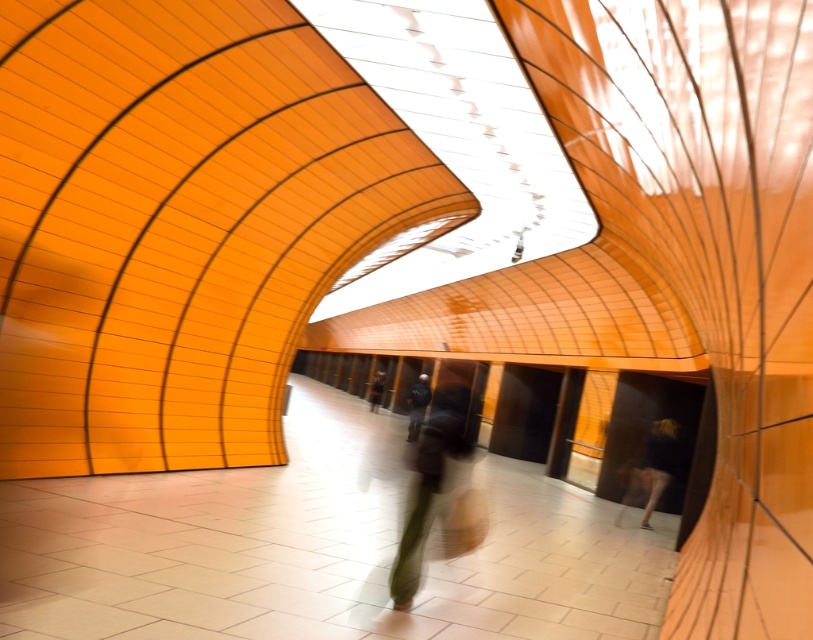
You are standing at the point marked as point (420, 401) in a modern terminal with a curved ceiling. You want to take a photo of the entire ceiling structure. Since the camera you have can capture a maximum distance of 20 meters, will you be able to capture the entire ceiling structure in one shot?

The distance between point (420, 401) and the camera is 20.18 meters, which exceeds the camera maximum distance of 20 meters. Therefore, you will not be able to capture the entire ceiling structure in one shot.

Looking at this image, you are a security guard in this modern terminal and need to determine if the dark gray fabric bag at center can be placed inside the dark blue jacket at center without removing the jacket. Can it fit?

The dark gray fabric bag at center is bigger than the dark blue jacket at center, so it cannot fit inside the jacket without removing it.

You are standing in the modern station and see the dark gray fabric bag at center and the dark blue fabric at lower right. Which object is positioned more to the right side of the scene?

The dark blue fabric at lower right is positioned more to the right side of the scene than the dark gray fabric bag at center.